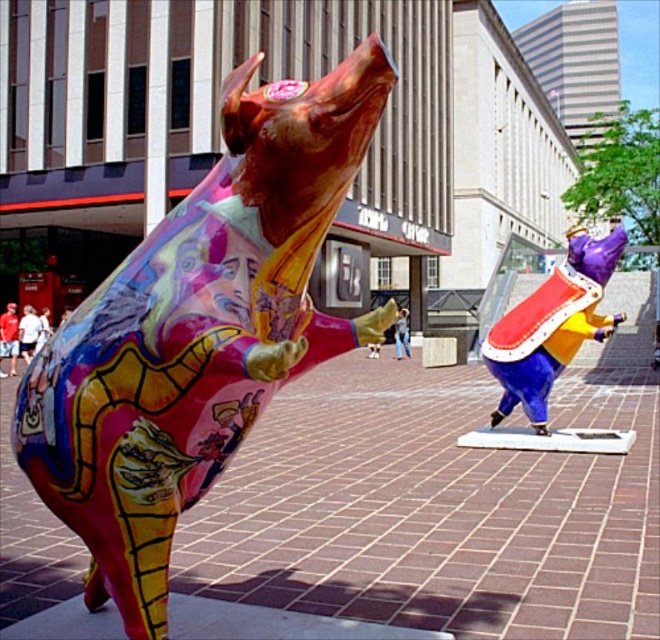
Question: Which object is farther from the camera taking this photo?

Choices:
 (A) multicolored painted bull at center
 (B) shiny purple and gold helmet at center

Answer: (B)

Question: Is multicolored painted bull at center wider than shiny purple and gold helmet at center?

Choices:
 (A) no
 (B) yes

Answer: (A)

Question: Does multicolored painted bull at center appear on the right side of shiny purple and gold helmet at center?

Choices:
 (A) yes
 (B) no

Answer: (B)

Question: Is multicolored painted bull at center in front of shiny purple and gold helmet at center?

Choices:
 (A) no
 (B) yes

Answer: (B)

Question: Which point appears closest to the camera in this image?

Choices:
 (A) (198, 266)
 (B) (515, 344)

Answer: (A)